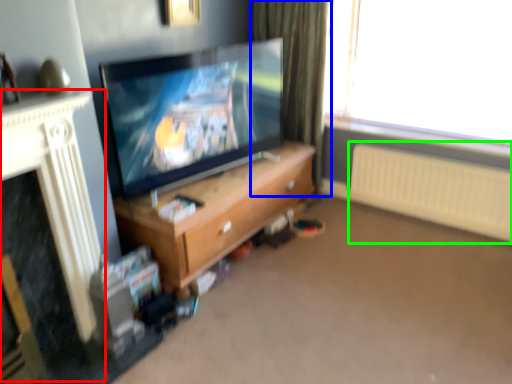
Question: Which object is positioned farthest from fireplace (highlighted by a red box)? Select from curtain (highlighted by a blue box) and radiator (highlighted by a green box).

Choices:
 (A) curtain
 (B) radiator

Answer: (B)